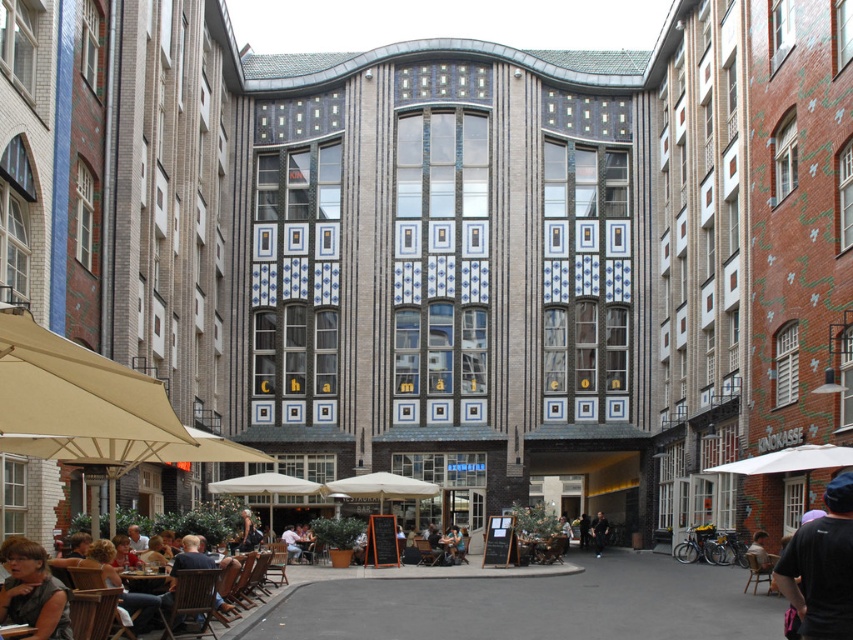
You are a customer at the outdoor seating area of the cafe. You want to place your dark blue fabric cap somewhere so that it doesn not get blown away by the wind. Which object between the dark blue fabric cap at lower right and the wooden table at lower left would be a better place to put it?

The wooden table at lower left is shorter than the dark blue fabric cap at lower right. Therefore, placing the cap on the wooden table at lower left would be more stable and less likely to be blown away by the wind.

You are a customer at the outdoor seating area of the Art Deco building. You want to place your dark blue fabric cap somewhere so it won not fall off. Which object between the dark blue fabric cap at lower right and the wooden table at center is taller and thus safer to place it on?

The dark blue fabric cap at lower right is taller than the wooden table at center. Therefore, placing the cap on the wooden table at center would be safer as it has a lower height and less risk of falling off.

In the scene shown: You are a photographer standing in the courtyard and want to take a photo of the dark blue fabric cap at lower right and the black leather jacket at center. Which object should you adjust your camera focus on first if you want to capture both clearly in the same frame?

The dark blue fabric cap at lower right is located above the black leather jacket at center, so you should focus on the black leather jacket at center first as it is closer to the camera, ensuring both objects are in focus.